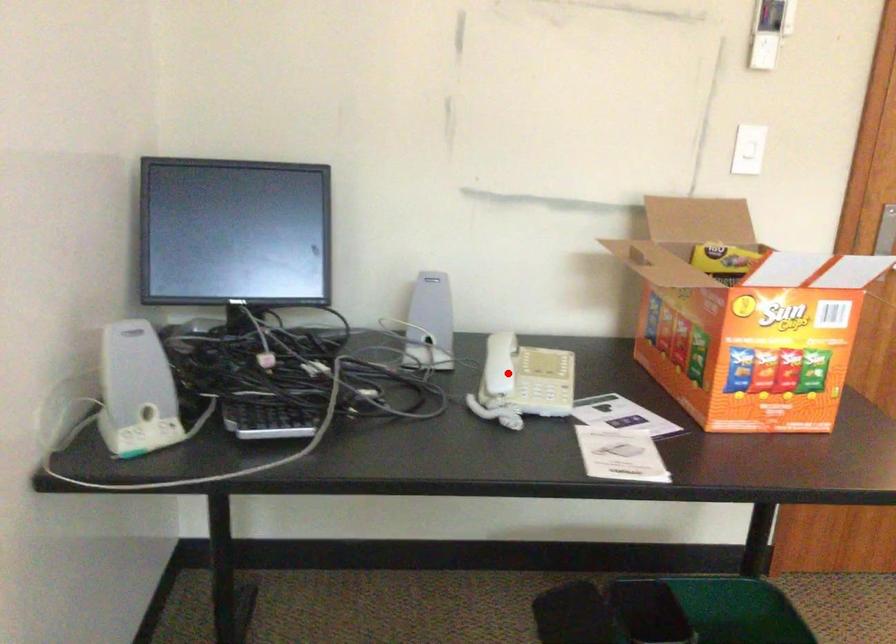
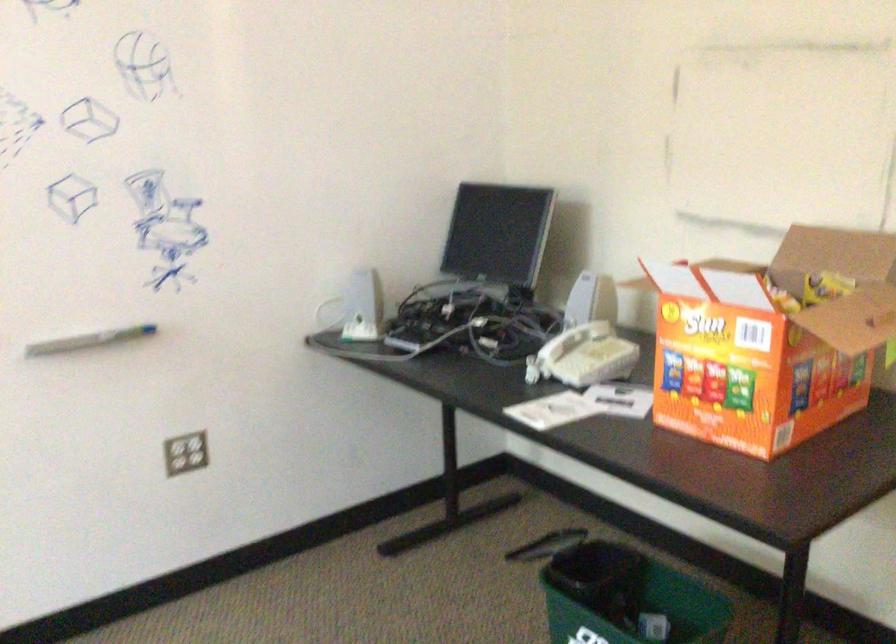
In the second image, find the point that corresponds to the highlighted location in the first image.

(558, 345)